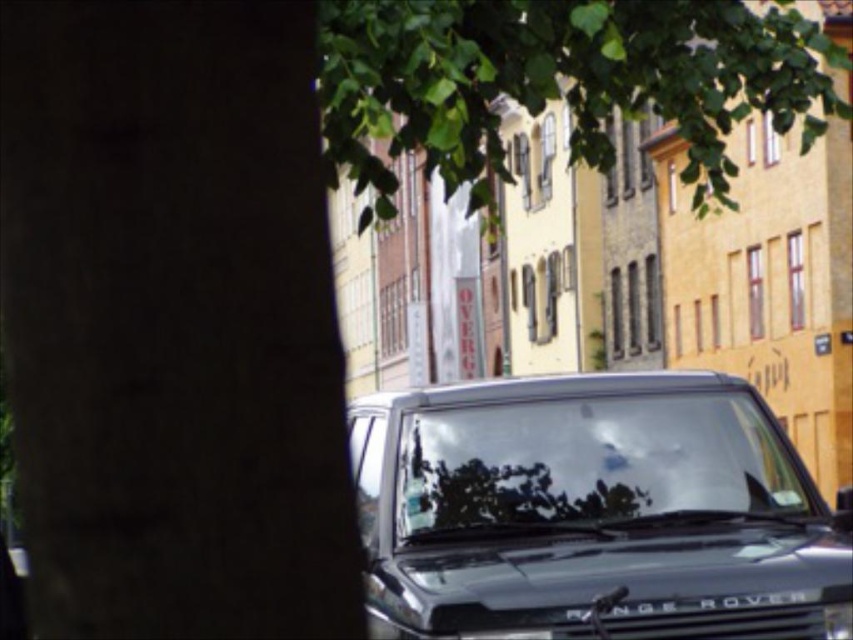
You are a delivery person needing to place a package between the shiny black range rover at center and the green leafy tree at upper center. The package requires a space of 3 meters. Is there enough space between them?

The distance between the shiny black range rover at center and the green leafy tree at upper center is 3.25 meters, which is sufficient to accommodate the package requiring 3 meters of space.

You are a pedestrian standing at the edge of the street facing the shiny black range rover at center and the green leafy tree at upper center. Which object is closer to your right side?

The green leafy tree at upper center is closer to your right side because the shiny black range rover at center is positioned to the left of it.